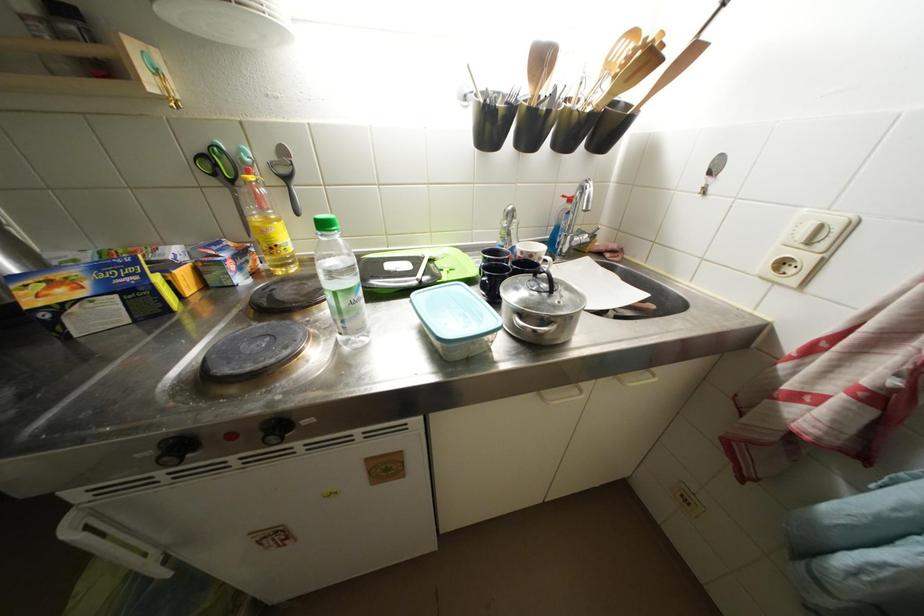
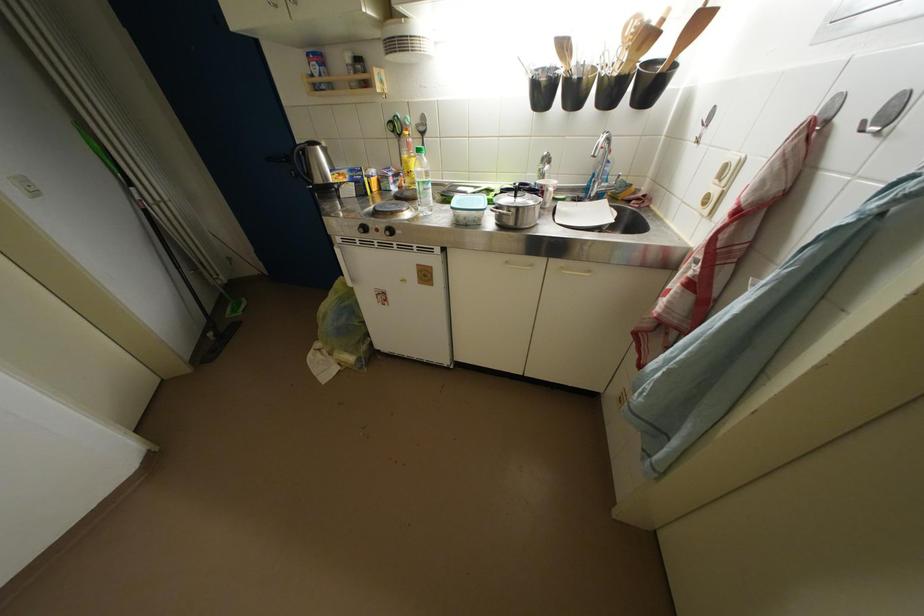
Locate, in the second image, the point that corresponds to [270,235] in the first image.

(412, 167)